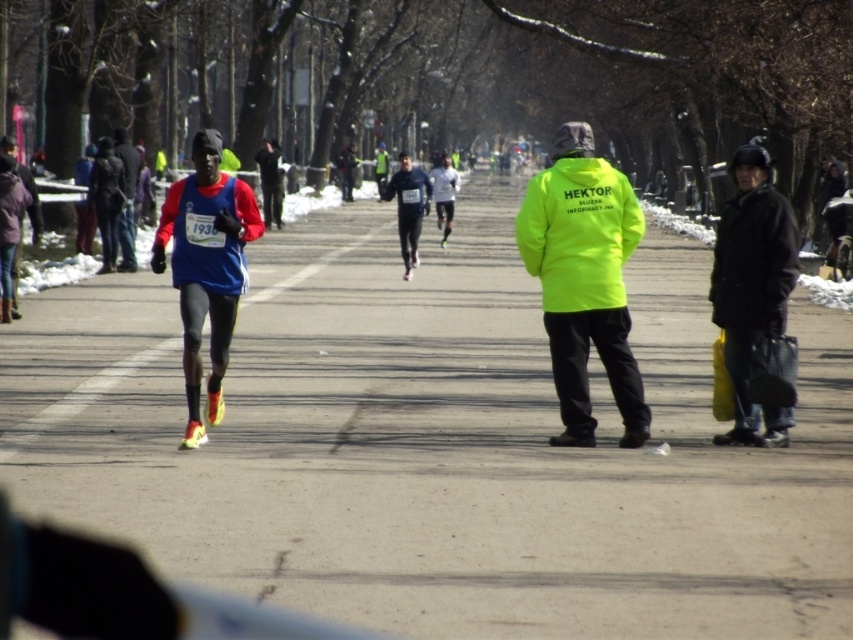
Question: Among these objects, which one is farthest from the camera?

Choices:
 (A) blue fabric running suit at left
 (B) blue fabric jacket at center
 (C) gray asphalt road at center
 (D) neon yellow jacket at center

Answer: (B)

Question: Which of the following is the closest to the observer?

Choices:
 (A) (x=405, y=160)
 (B) (x=119, y=218)
 (C) (x=592, y=148)

Answer: (C)

Question: Which of the following is the farthest from the observer?

Choices:
 (A) blue fabric jacket at center
 (B) black matte jacket at right

Answer: (A)

Question: Is black matte jacket at right to the left of blue fabric running suit at left from the viewer's perspective?

Choices:
 (A) yes
 (B) no

Answer: (B)

Question: Does neon yellow jacket at center appear under white matte running suit at center?

Choices:
 (A) no
 (B) yes

Answer: (B)

Question: Is the position of blue fabric jacket at center more distant than that of white matte running suit at center?

Choices:
 (A) no
 (B) yes

Answer: (B)